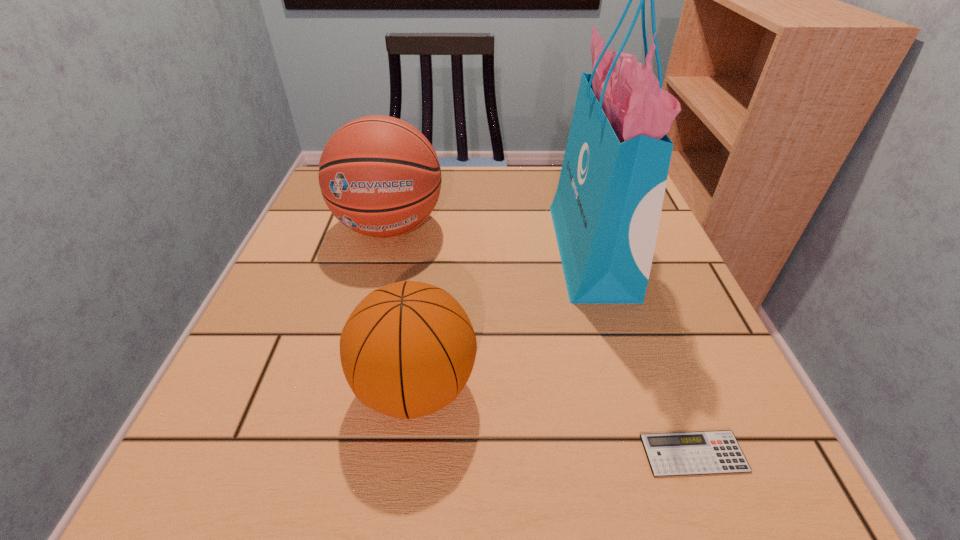
You are a GUI agent. You are given a task and a screenshot of the screen. Output one action in this format:
    pyautogui.click(x=<x>, y=<y>)
    Task: Click on the tallest object
    
    Given the screenshot: What is the action you would take?
    606,211

The image size is (960, 540). I want to click on the farther basketball, so click(x=379, y=175).

The width and height of the screenshot is (960, 540). Find the location of `the taller basketball`. the taller basketball is located at coordinates (379, 175).

Locate an element on the screen. the nearer basketball is located at coordinates pyautogui.click(x=407, y=350).

Find the location of a particular element. the third tallest object is located at coordinates (407, 350).

At what (x,y) coordinates should I click in order to perform the action: click on the shortest object. Please return your answer as a coordinate pair (x, y). This screenshot has width=960, height=540. Looking at the image, I should click on (703, 452).

You are a GUI agent. You are given a task and a screenshot of the screen. Output one action in this format:
    pyautogui.click(x=<x>, y=<y>)
    Task: Click on the blank space located on the front of the shopping bag
    The image size is (960, 540).
    Given the screenshot: What is the action you would take?
    pyautogui.click(x=628, y=372)

Find the location of `blank space located on the logo side of the third shortest object`. blank space located on the logo side of the third shortest object is located at coordinates (373, 289).

At what (x,y) coordinates should I click in order to perform the action: click on vacant region located on the back of the second shortest object. Please return your answer as a coordinate pair (x, y). This screenshot has height=540, width=960. Looking at the image, I should click on (434, 244).

In order to click on vacant space positioned 0.300m on the left of the shortest object in this screenshot , I will do `click(418, 454)`.